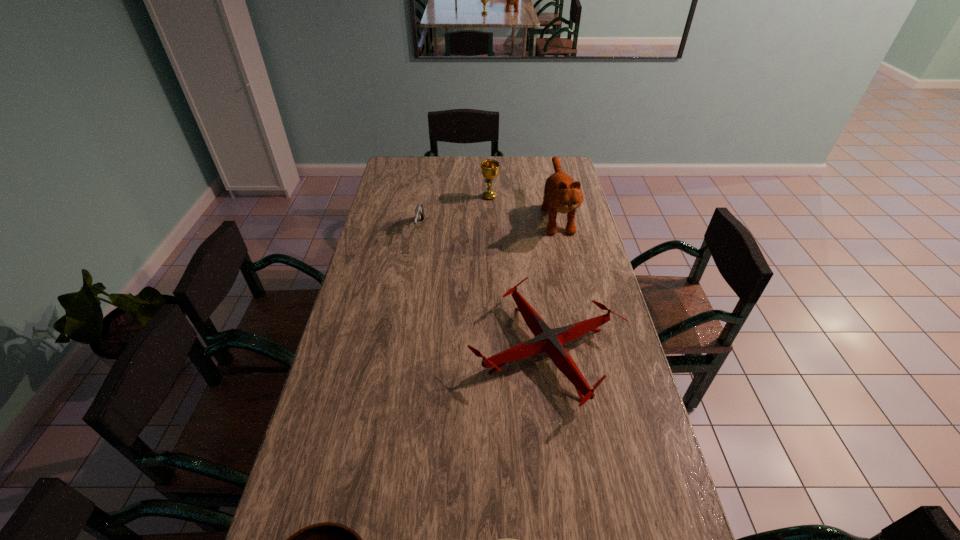
Locate an element on the screen. cat is located at coordinates (561, 194).

Locate an element on the screen. chalice is located at coordinates (489, 168).

You are a GUI agent. You are given a task and a screenshot of the screen. Output one action in this format:
    pyautogui.click(x=<x>, y=<y>)
    Task: Click on the gun
    The width and height of the screenshot is (960, 540).
    Given the screenshot: What is the action you would take?
    pyautogui.click(x=419, y=211)

You are a GUI agent. You are given a task and a screenshot of the screen. Output one action in this format:
    pyautogui.click(x=<x>, y=<y>)
    Task: Click on the second shortest object
    Image resolution: width=960 pixels, height=540 pixels.
    Given the screenshot: What is the action you would take?
    pyautogui.click(x=548, y=340)

Find the location of a particular element. The height and width of the screenshot is (540, 960). the fourth farthest object is located at coordinates (548, 340).

The width and height of the screenshot is (960, 540). Find the location of `vacant space located on the face of the tallest object`. vacant space located on the face of the tallest object is located at coordinates (570, 272).

Identify the location of free region located on the right of the second tallest object. This screenshot has width=960, height=540. (572, 197).

You are a GUI agent. You are given a task and a screenshot of the screen. Output one action in this format:
    pyautogui.click(x=<x>, y=<y>)
    Task: Click on the vacant space situated 0.100m at the muzzle of the gun
    This screenshot has height=540, width=960.
    Given the screenshot: What is the action you would take?
    click(415, 259)

Find the location of a particular element. vacant space located 0.180m on the back of the fourth farthest object is located at coordinates (535, 261).

You are a GUI agent. You are given a task and a screenshot of the screen. Output one action in this format:
    pyautogui.click(x=<x>, y=<y>)
    Task: Click on the cat that is at the right edge
    The height and width of the screenshot is (540, 960).
    Given the screenshot: What is the action you would take?
    pyautogui.click(x=561, y=194)